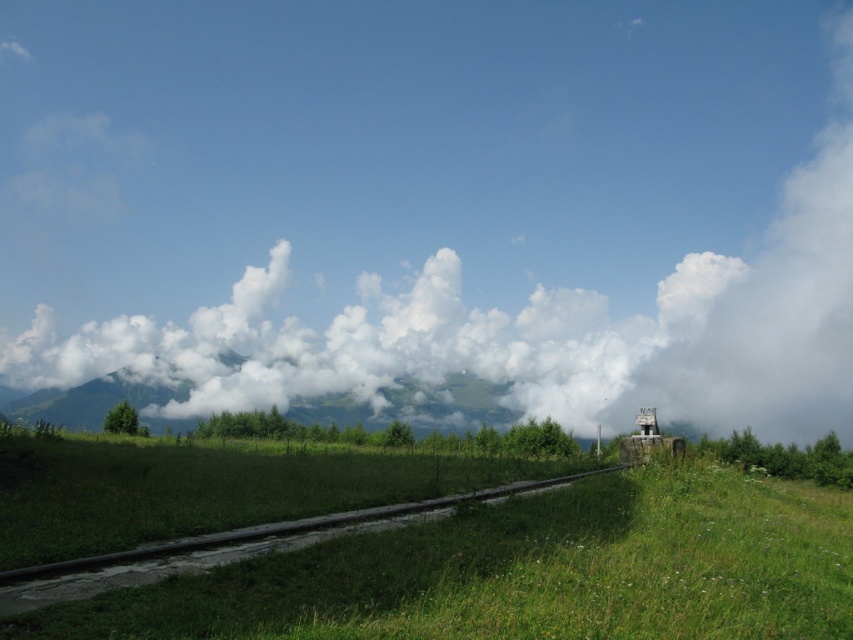
Question: Can you confirm if white fluffy cloud at upper center is positioned below green grassy at center?

Choices:
 (A) no
 (B) yes

Answer: (A)

Question: Can you confirm if white fluffy cloud at upper center is positioned to the left of green grassy at center?

Choices:
 (A) no
 (B) yes

Answer: (B)

Question: Can you confirm if white fluffy cloud at upper center is wider than green grassy at center?

Choices:
 (A) no
 (B) yes

Answer: (B)